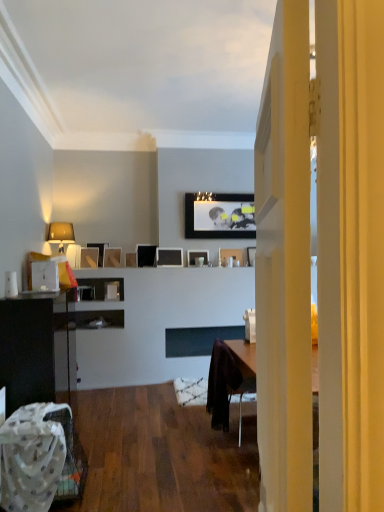
You are a GUI agent. You are given a task and a screenshot of the screen. Output one action in this format:
    pyautogui.click(x=<x>, y=<y>)
    Task: Click on the vacant space in between velvet dark brown swivel chair at center and white fabric chair at lower left
    
    Given the screenshot: What is the action you would take?
    pyautogui.click(x=148, y=460)